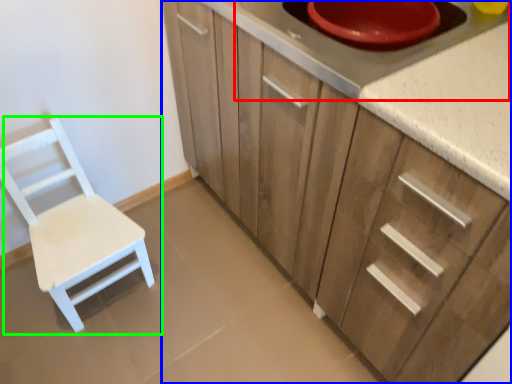
Question: Considering the real-world distances, which object is closest to appliance (highlighted by a red box)? cabinetry (highlighted by a blue box) or chair (highlighted by a green box).

Choices:
 (A) cabinetry
 (B) chair

Answer: (A)